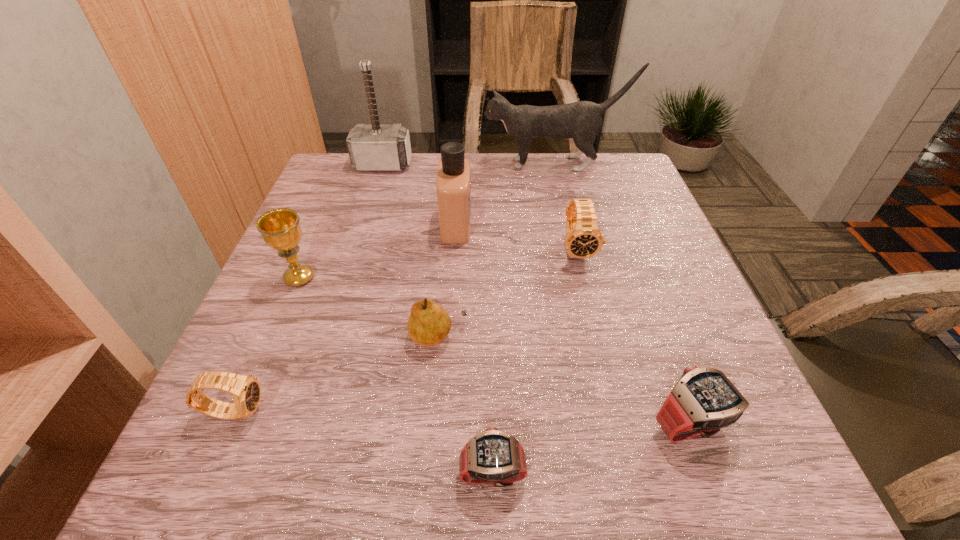
At what (x,y) coordinates should I click in order to perform the action: click on free region located 0.400m on the right of the chalice. Please return your answer as a coordinate pair (x, y). The height and width of the screenshot is (540, 960). Looking at the image, I should click on (516, 278).

The width and height of the screenshot is (960, 540). I want to click on free space located 0.090m on the face of the third watch from left to right, so click(589, 300).

The image size is (960, 540). What are the coordinates of `free region located on the back of the pear` in the screenshot? It's located at (442, 297).

Where is `vacant area located 0.140m on the back of the right red watch`? vacant area located 0.140m on the back of the right red watch is located at coordinates (656, 329).

Find the location of a particular element. The width and height of the screenshot is (960, 540). free space located 0.290m on the face of the smaller black watch is located at coordinates (451, 411).

Find the location of a particular element. vacant space situated 0.140m on the left of the shortest watch is located at coordinates (359, 472).

This screenshot has width=960, height=540. I want to click on hammer present at the far edge, so click(374, 147).

Identify the location of cat that is at the far edge. Image resolution: width=960 pixels, height=540 pixels. (581, 121).

Where is `hammer that is positioned at the left edge`? This screenshot has height=540, width=960. hammer that is positioned at the left edge is located at coordinates (374, 147).

Where is `chalice at the left edge`? The image size is (960, 540). chalice at the left edge is located at coordinates (280, 229).